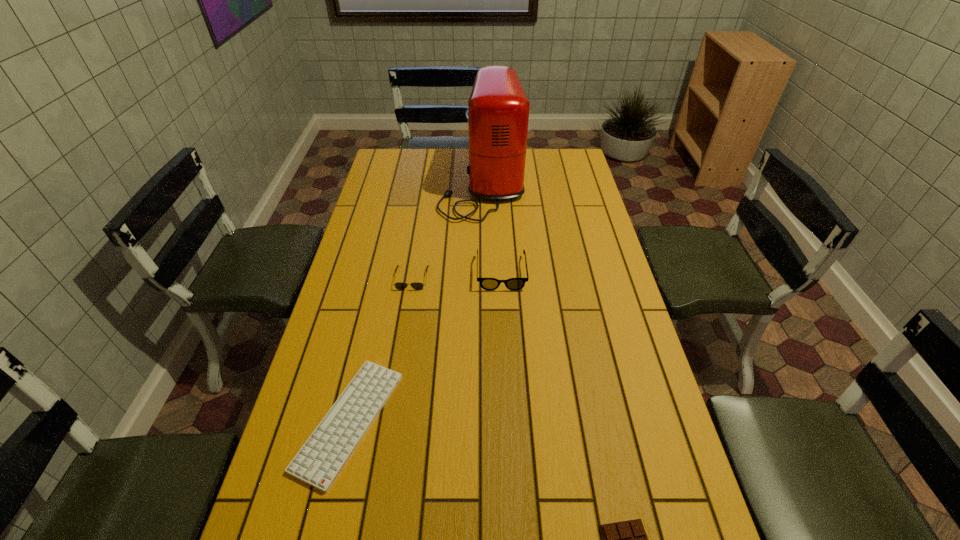
Identify the location of the tallest object. This screenshot has width=960, height=540. (498, 109).

At what (x,y) coordinates should I click in order to perform the action: click on the farthest object. Please return your answer as a coordinate pair (x, y). This screenshot has height=540, width=960. Looking at the image, I should click on (498, 109).

Find the location of a particular element. The width and height of the screenshot is (960, 540). spectacles is located at coordinates (489, 284).

Where is `the third tallest object`? The width and height of the screenshot is (960, 540). the third tallest object is located at coordinates (399, 285).

Locate an element on the screen. The width and height of the screenshot is (960, 540). computer keyboard is located at coordinates (319, 462).

Where is `vacant position located 0.200m on the front-facing side of the tallest object`? The height and width of the screenshot is (540, 960). vacant position located 0.200m on the front-facing side of the tallest object is located at coordinates click(392, 184).

I want to click on vacant region located on the front-facing side of the tallest object, so click(x=382, y=184).

Where is `vacant space positioned 0.120m on the front-facing side of the tallest object`? This screenshot has width=960, height=540. vacant space positioned 0.120m on the front-facing side of the tallest object is located at coordinates (411, 184).

Image resolution: width=960 pixels, height=540 pixels. In order to click on vacant space positioned on the arms of the fourth shortest object in this screenshot , I will do `click(503, 312)`.

Identify the location of vacant region located on the front-facing side of the third shortest object. The height and width of the screenshot is (540, 960). (403, 333).